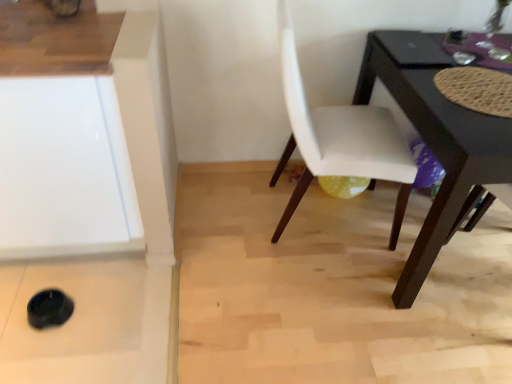
Question: Is the position of white leather chair at center less distant than that of glossy black table at lower right?

Choices:
 (A) no
 (B) yes

Answer: (A)

Question: Would you say white leather chair at center is outside glossy black table at lower right?

Choices:
 (A) yes
 (B) no

Answer: (A)

Question: Can you confirm if white leather chair at center is positioned to the left of glossy black table at lower right?

Choices:
 (A) no
 (B) yes

Answer: (B)

Question: Does white leather chair at center have a larger size compared to glossy black table at lower right?

Choices:
 (A) yes
 (B) no

Answer: (B)

Question: From the image's perspective, does white leather chair at center appear higher than glossy black table at lower right?

Choices:
 (A) yes
 (B) no

Answer: (A)

Question: From their relative heights in the image, would you say white glossy cabinet at lower left is taller or shorter than white leather chair at center?

Choices:
 (A) tall
 (B) short

Answer: (B)

Question: Considering the positions of point (33, 175) and point (296, 74), is point (33, 175) closer or farther from the camera than point (296, 74)?

Choices:
 (A) closer
 (B) farther

Answer: (A)

Question: Considering the positions of white glossy cabinet at lower left and white leather chair at center in the image, is white glossy cabinet at lower left bigger or smaller than white leather chair at center?

Choices:
 (A) small
 (B) big

Answer: (B)

Question: Is white glossy cabinet at lower left inside or outside of white leather chair at center?

Choices:
 (A) inside
 (B) outside

Answer: (B)

Question: From the image's perspective, is white leather chair at center positioned above or below glossy black table at lower right?

Choices:
 (A) below
 (B) above

Answer: (B)

Question: Based on their sizes in the image, would you say white leather chair at center is bigger or smaller than glossy black table at lower right?

Choices:
 (A) big
 (B) small

Answer: (B)

Question: Based on their positions, is white leather chair at center located to the left or right of glossy black table at lower right?

Choices:
 (A) left
 (B) right

Answer: (A)

Question: From a real-world perspective, relative to glossy black table at lower right, is white leather chair at center vertically above or below?

Choices:
 (A) above
 (B) below

Answer: (A)

Question: Is glossy black table at lower right wider or thinner than white leather chair at center?

Choices:
 (A) thin
 (B) wide

Answer: (B)

Question: From their relative heights in the image, would you say glossy black table at lower right is taller or shorter than white leather chair at center?

Choices:
 (A) tall
 (B) short

Answer: (B)